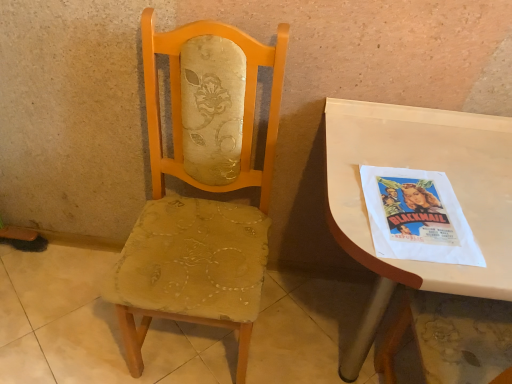
The height and width of the screenshot is (384, 512). Identify the location of vacant area situated below white paper poster at right (from a real-world perspective). (412, 211).